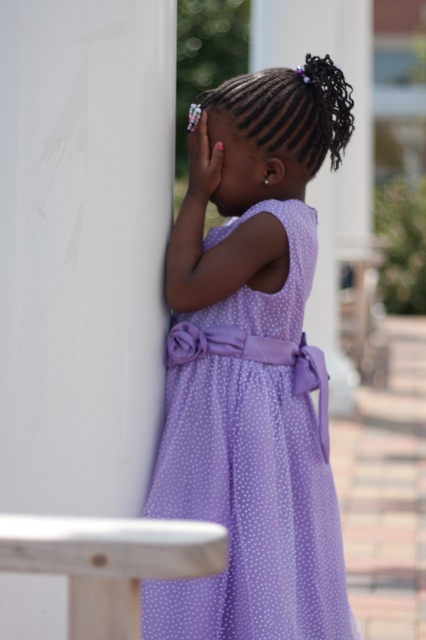
Who is more distant from viewer, (11, 269) or (282, 348)?

The point (282, 348) is behind.

Which of these two, white smooth pillar at left or lavender polka dot dress at center, stands shorter?

lavender polka dot dress at center is shorter.

Who is more distant from viewer, (63, 614) or (164, 589)?

Point (164, 589)

The height and width of the screenshot is (640, 426). I want to click on white smooth pillar at left, so click(83, 248).